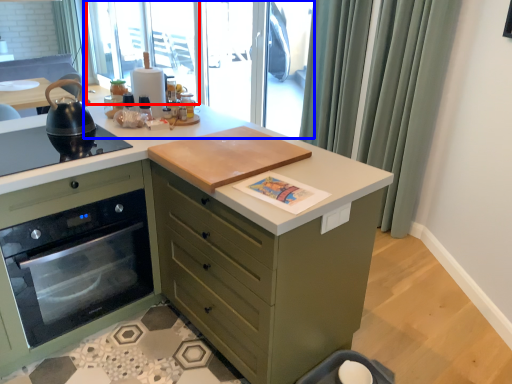
Question: Which object is closer to the camera taking this photo, window screen (highlighted by a red box) or window screen (highlighted by a blue box)?

Choices:
 (A) window screen
 (B) window screen

Answer: (B)